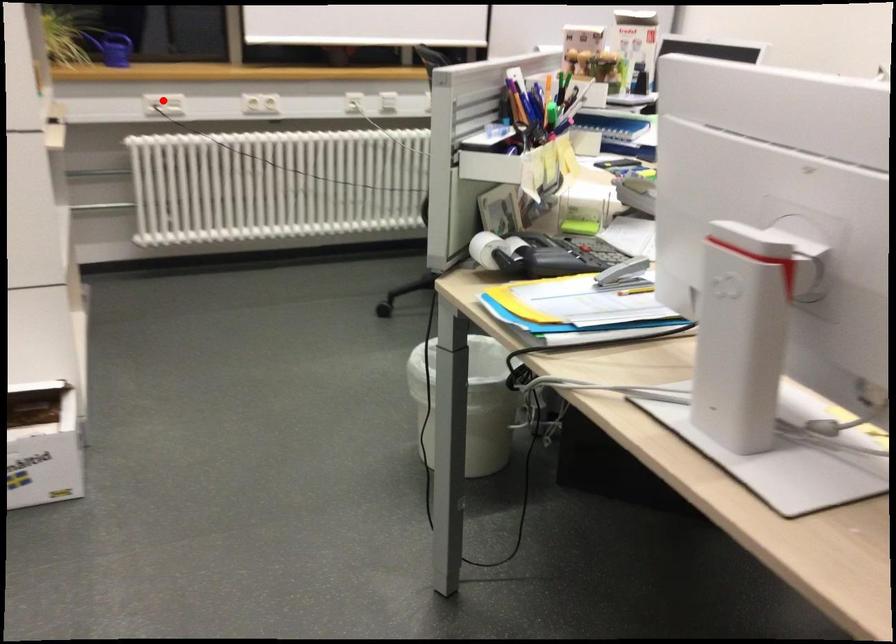
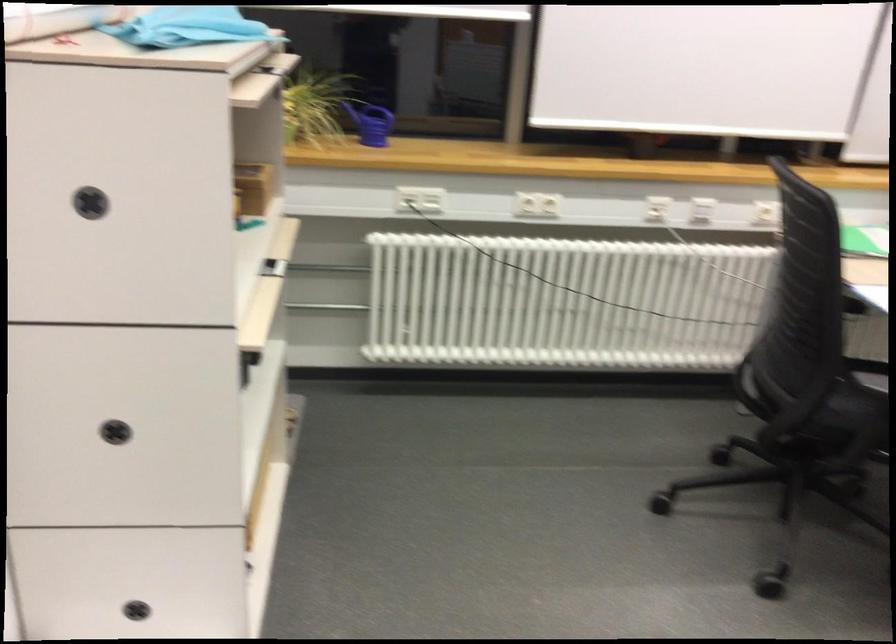
Find the pixel in the second image that matches the highlighted location in the first image.

(419, 199)